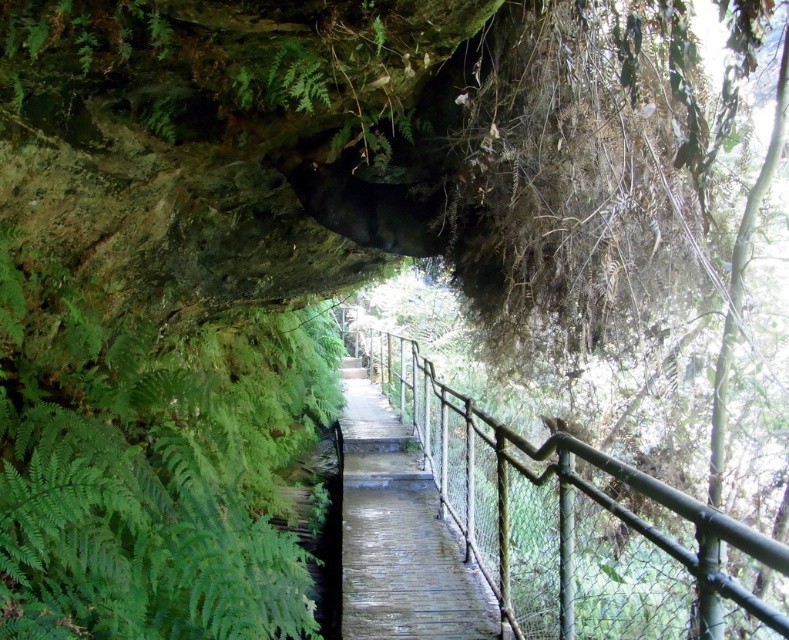
Question: From the image, what is the correct spatial relationship of green metal/rusty rail at center in relation to wooden bridge at center?

Choices:
 (A) below
 (B) above

Answer: (B)

Question: Which point is farther to the camera?

Choices:
 (A) green leafy ferns at left
 (B) green metal/rusty rail at center
 (C) wooden bridge at center

Answer: (C)

Question: Is green leafy ferns at left above green metal/rusty rail at center?

Choices:
 (A) yes
 (B) no

Answer: (A)

Question: Which point is farther from the camera taking this photo?

Choices:
 (A) (384, 516)
 (B) (23, 492)

Answer: (A)

Question: Can you confirm if green leafy ferns at left is thinner than green metal/rusty rail at center?

Choices:
 (A) no
 (B) yes

Answer: (A)

Question: Which object is closer to the camera taking this photo?

Choices:
 (A) wooden bridge at center
 (B) green metal/rusty rail at center

Answer: (B)